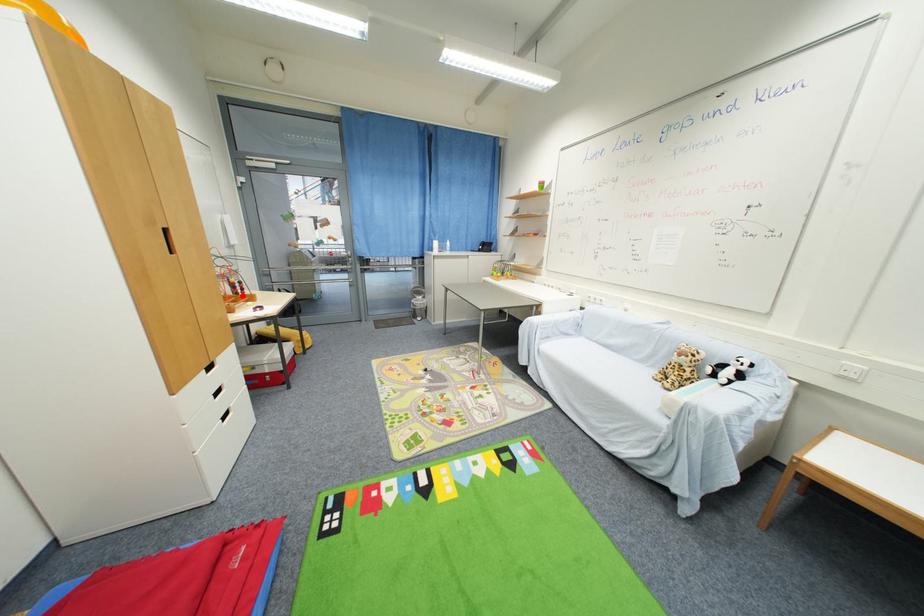
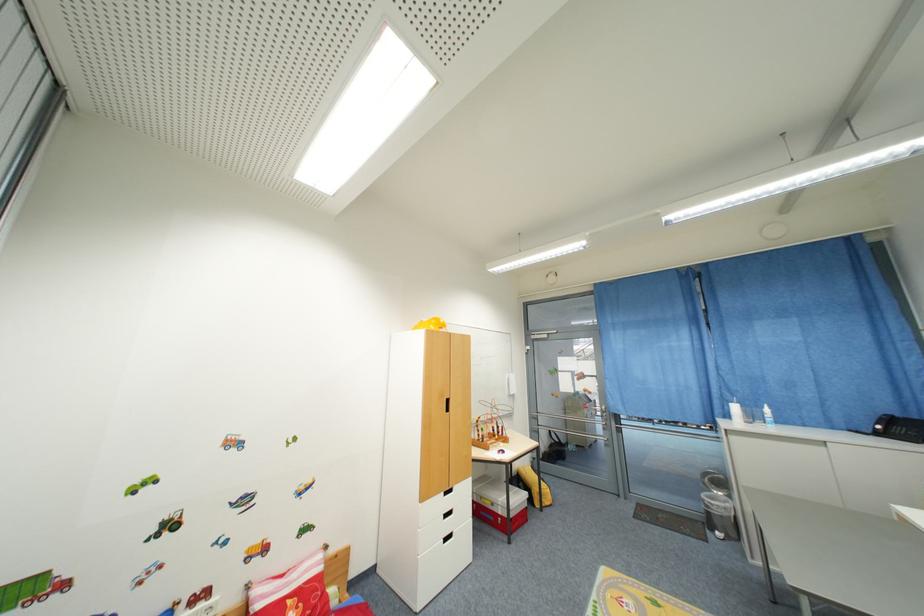
Question: I am providing you with two images of the same scene from different viewpoints. A red point is shown in image1. For the corresponding object point in image2, is it positioned nearer or farther from the camera?

Choices:
 (A) Nearer
 (B) Farther

Answer: (B)